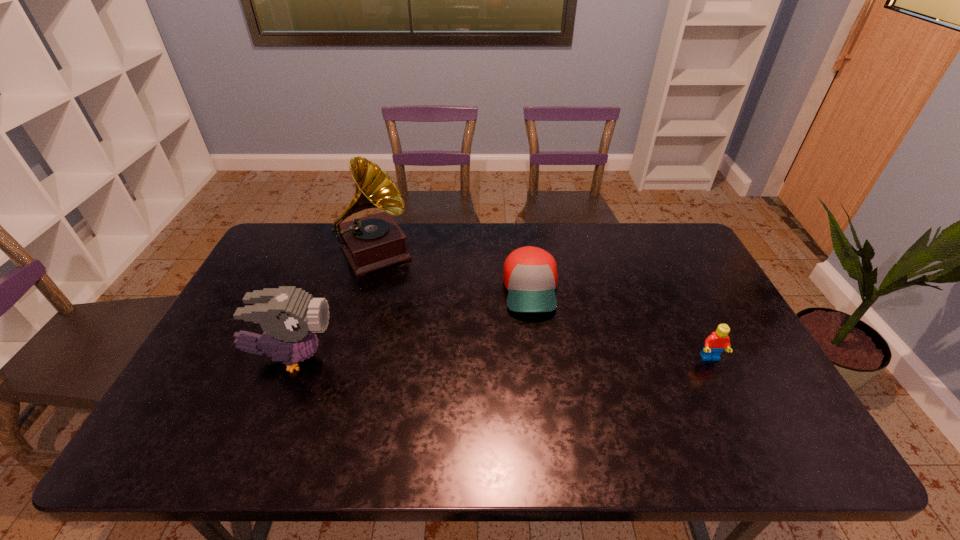
The image size is (960, 540). Identify the location of vacant spot on the desktop that is between the bird and the rightmost object and is positioned from the horn of the phonograph record. (441, 359).

Locate an element on the screen. vacant space on the desktop that is between the third shortest object and the Lego and is positioned at the brim of the second object from right to left is located at coordinates (540, 359).